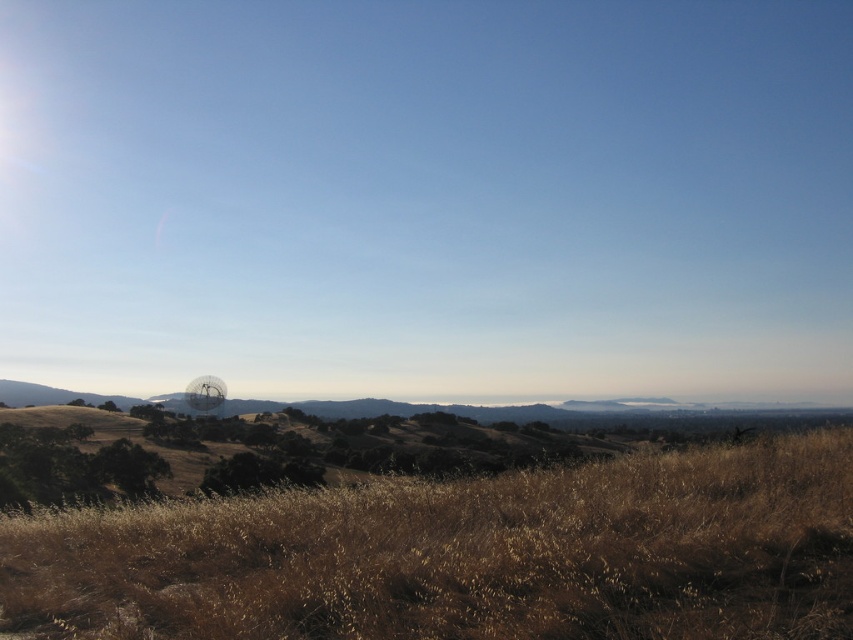
From the picture: Is brown dry grass at lower center below brown grassland at center?

No, brown dry grass at lower center is not below brown grassland at center.

Who is higher up, brown dry grass at lower center or brown grassland at center?

Positioned higher is brown dry grass at lower center.

I want to click on brown dry grass at lower center, so point(465,556).

Where is `brown dry grass at lower center`? brown dry grass at lower center is located at coordinates (465, 556).